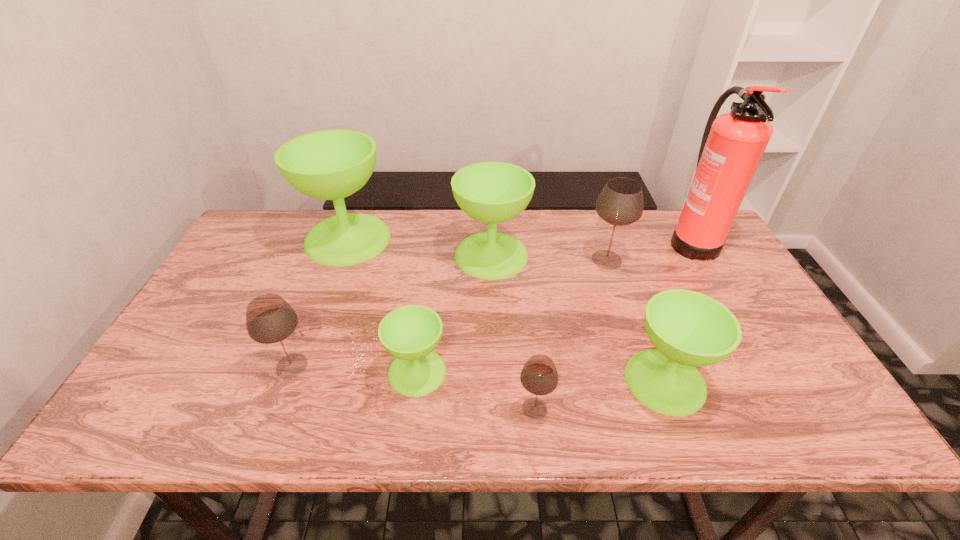
Where is `vacant position located on the back of the second smallest gray wineglass`? vacant position located on the back of the second smallest gray wineglass is located at coordinates (319, 297).

Locate an element on the screen. vacant space located 0.160m on the back of the third biggest green wineglass is located at coordinates (636, 303).

The height and width of the screenshot is (540, 960). In order to click on vacant space located 0.380m on the left of the third wineglass from left to right in this screenshot , I will do `click(226, 372)`.

This screenshot has width=960, height=540. What are the coordinates of `vacant space located 0.240m on the back of the nearest gray wineglass` in the screenshot? It's located at (525, 315).

I want to click on fire extinguisher situated at the far edge, so (x=733, y=144).

The image size is (960, 540). What are the coordinates of `object that is at the right edge` in the screenshot? It's located at tap(733, 144).

Locate an element on the screen. object at the far right corner is located at coordinates (733, 144).

Where is `vacant space at the far edge of the desktop`? vacant space at the far edge of the desktop is located at coordinates (562, 240).

Locate an element on the screen. free region at the near edge is located at coordinates (388, 403).

The image size is (960, 540). Find the location of `blank space at the left edge of the desktop`. blank space at the left edge of the desktop is located at coordinates (208, 341).